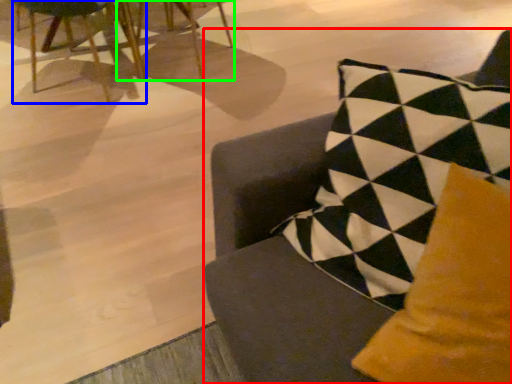
Question: Based on their relative distances, which object is farther from chair (highlighted by a red box)? Choose from chair (highlighted by a blue box) and chair (highlighted by a green box).

Choices:
 (A) chair
 (B) chair

Answer: (B)